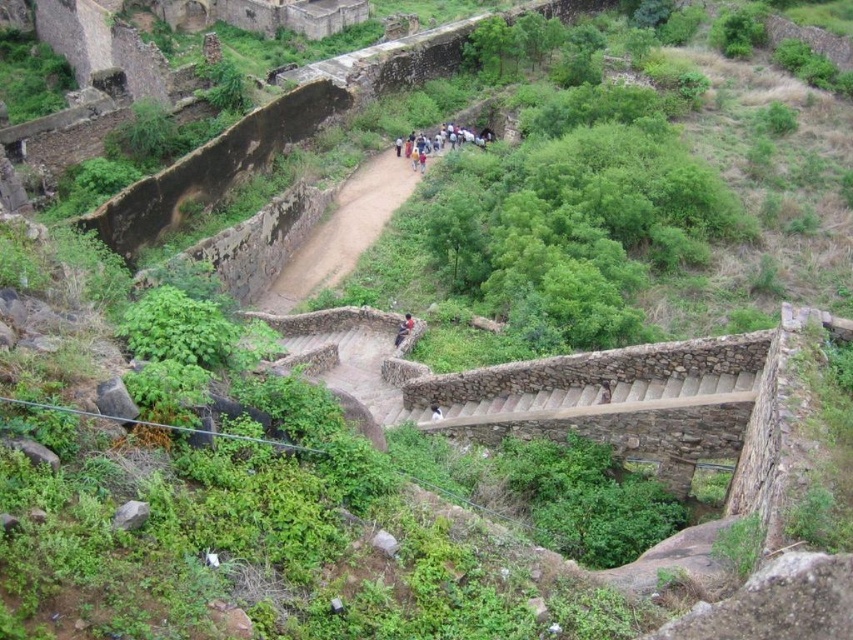
You are a visitor at this historical site and notice a smooth skin person at center and a dark blue fabric at center. Which object takes up more space in the image?

The smooth skin person at center has a larger size compared to the dark blue fabric at center, so the smooth skin person at center takes up more space in the image.

You are standing at the top of the stone steps leading down into the valley. You see a multicolored clothing group at center and a smooth skin person at center. Which one is closer to you?

The multicolored clothing group at center is further away than the smooth skin person at center, so the smooth skin person at center is closer to you.